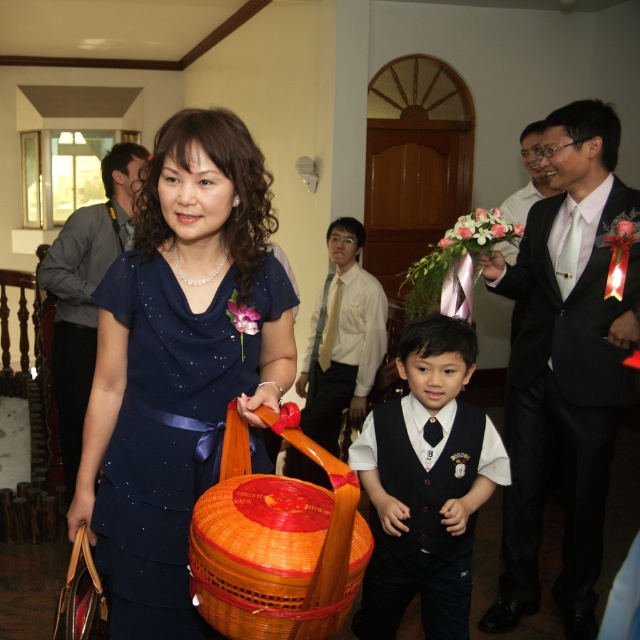
Question: Which object is positioned closest to the navy blue satin dress at center?

Choices:
 (A) matte gray shirt at upper left
 (B) matte black vest at center

Answer: (B)

Question: Can you confirm if black satin suit at right is positioned to the left of navy blue satin dress at center?

Choices:
 (A) yes
 (B) no

Answer: (B)

Question: Does matte gray shirt at upper left lie behind white shirt at center?

Choices:
 (A) no
 (B) yes

Answer: (A)

Question: Which of the following is the farthest from the observer?

Choices:
 (A) (422, 417)
 (B) (200, 586)

Answer: (A)

Question: Which object appears farthest from the camera in this image?

Choices:
 (A) matte black vest at center
 (B) navy blue satin dress at center
 (C) bright orange woven basket at center
 (D) black satin suit at right

Answer: (D)

Question: Does matte black vest at center have a larger size compared to matte gray shirt at upper left?

Choices:
 (A) yes
 (B) no

Answer: (B)